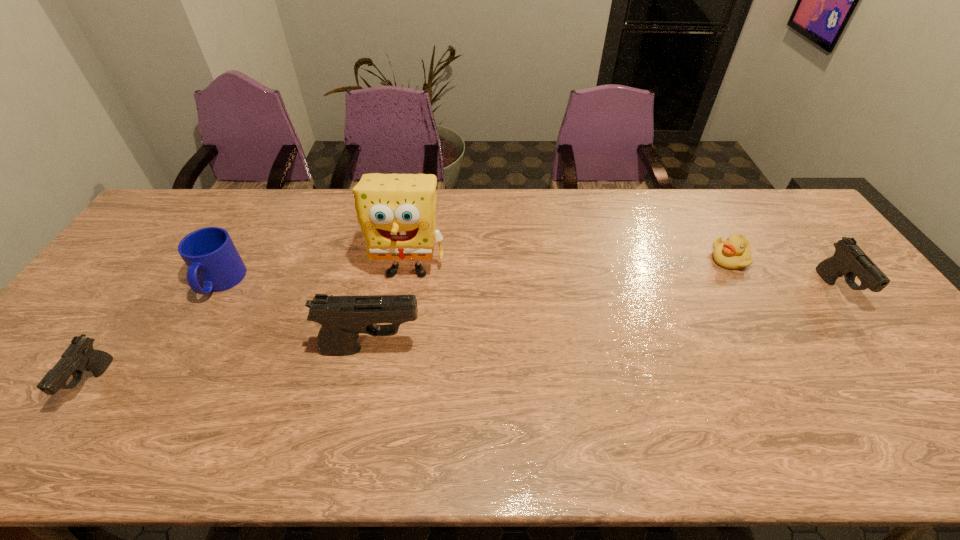
This screenshot has height=540, width=960. Identify the location of vacant space situated at the barrel of the tallest pistol. (463, 348).

The image size is (960, 540). Find the location of `free location located 0.130m at the barrel of the second tallest pistol`. free location located 0.130m at the barrel of the second tallest pistol is located at coordinates (886, 356).

Image resolution: width=960 pixels, height=540 pixels. Identify the location of free spot located on the side with the handle of the second object from left to right. (186, 342).

The image size is (960, 540). In order to click on free region located 0.300m on the front-facing side of the shortest object in this screenshot , I will do `click(613, 259)`.

The width and height of the screenshot is (960, 540). What are the coordinates of `vacant area situated on the front-facing side of the shortest object` in the screenshot? It's located at (597, 259).

You are a GUI agent. You are given a task and a screenshot of the screen. Output one action in this format:
    pyautogui.click(x=<x>, y=<y>)
    Task: Click on the free space located on the front-facing side of the shortest object
    
    Given the screenshot: What is the action you would take?
    pyautogui.click(x=676, y=259)

I want to click on blank area located 0.100m on the face of the tallest object, so click(400, 317).

Locate an element on the screen. The image size is (960, 540). object that is at the near edge is located at coordinates (79, 356).

The image size is (960, 540). What are the coordinates of `object present at the left edge` in the screenshot? It's located at (79, 356).

I want to click on object present at the right edge, so [849, 260].